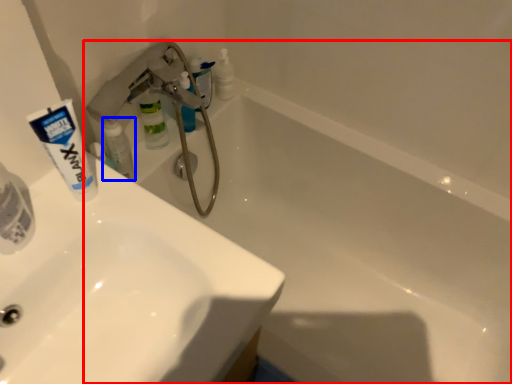
Question: Which point is further to the camera, bathtub (highlighted by a red box) or toiletry (highlighted by a blue box)?

Choices:
 (A) bathtub
 (B) toiletry

Answer: (B)